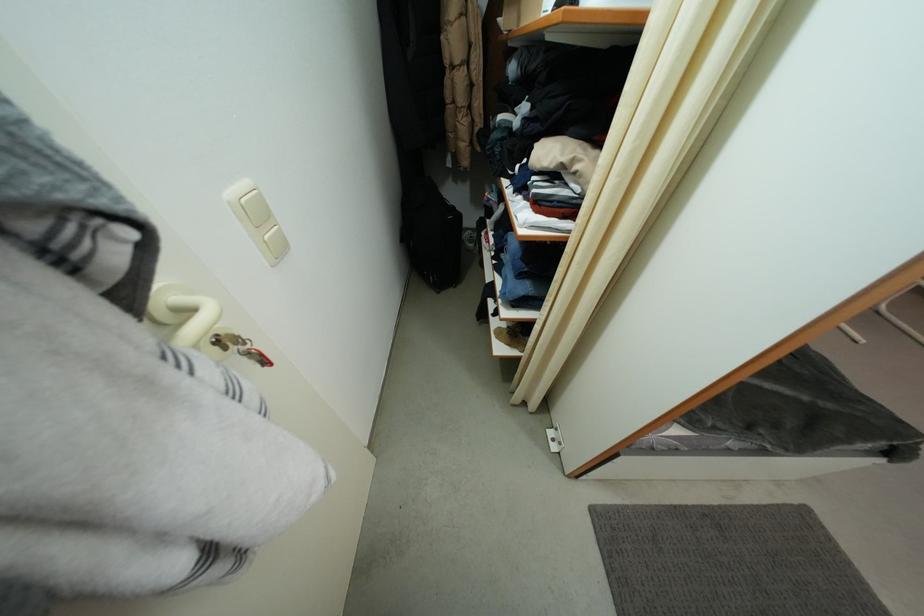
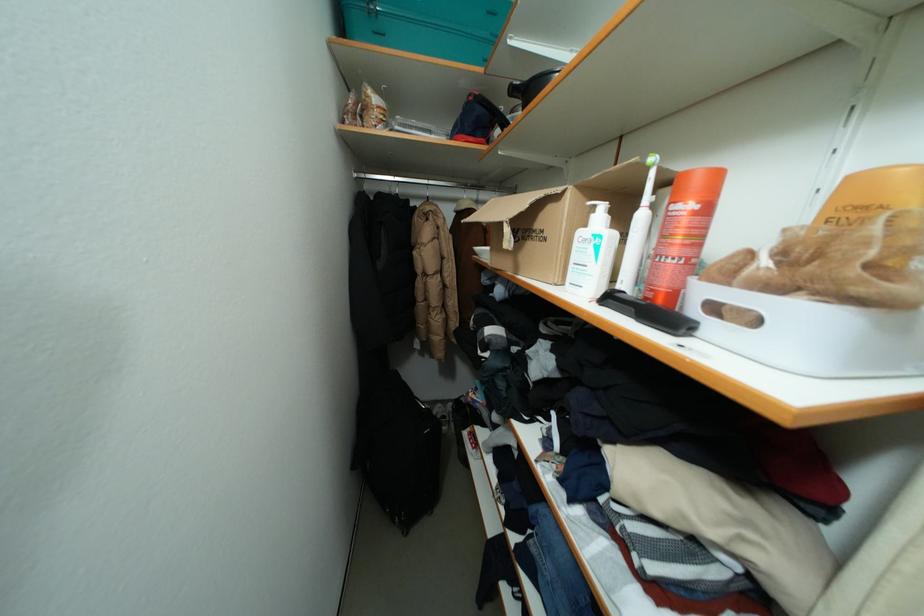
Question: Based on the continuous images, in which direction is the camera rotating? Reply with the corresponding letter.

Choices:
 (A) Left
 (B) Right
 (C) Up
 (D) Down

Answer: (C)